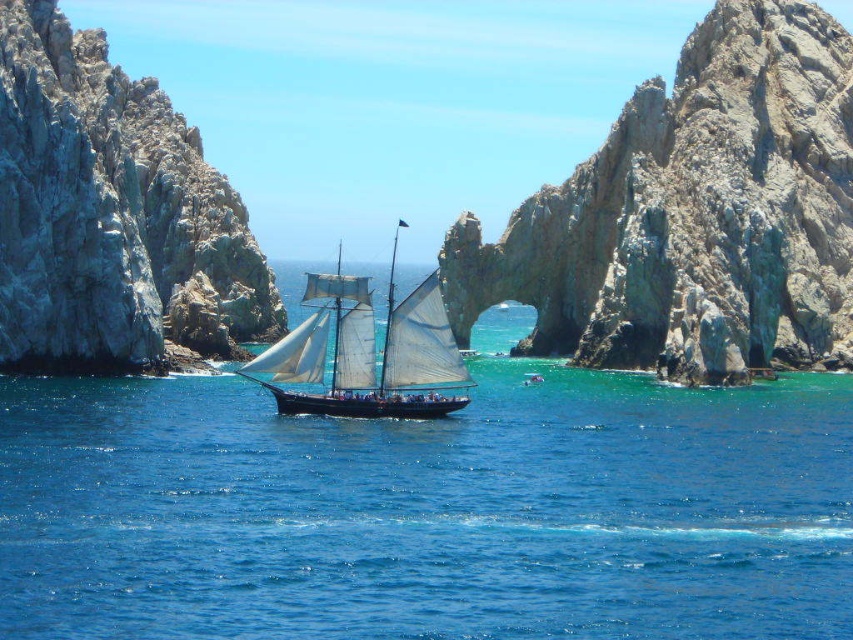
You are a sailor navigating a narrow passage between two large rocks. You see a rugged stone arch at center and a white canvas sailboat at center. Which object is bigger in size?

The rugged stone arch at center is larger in size than the white canvas sailboat at center.

You are a sailor navigating a boat through a narrow passage between two large rocks. You see the blue water at center and the rugged stone arch at center. Which object is positioned to the left of the other?

The blue water at center is to the left of the rugged stone arch at center.

You are a sailor navigating a boat through a narrow passage between two large rocks. You notice the blue water at center and the rugged stone arch at center. Which one is wider?

The blue water at center is wider than the rugged stone arch at center according to the description.